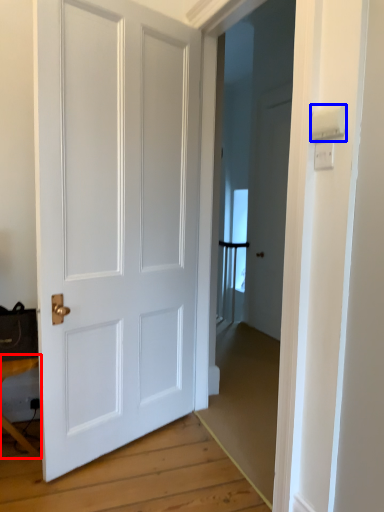
Question: Which point is further to the camera, table (highlighted by a red box) or light switch (highlighted by a blue box)?

Choices:
 (A) table
 (B) light switch

Answer: (A)